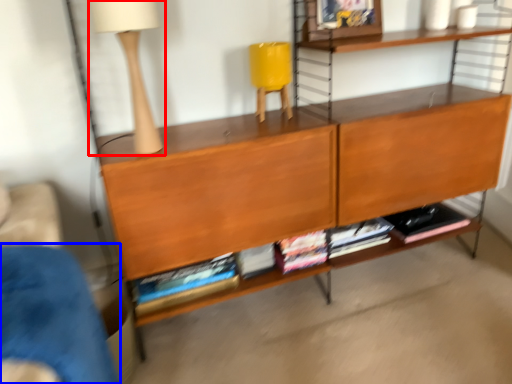
Question: Which object is further to the camera taking this photo, table lamp (highlighted by a red box) or armchair (highlighted by a blue box)?

Choices:
 (A) table lamp
 (B) armchair

Answer: (A)